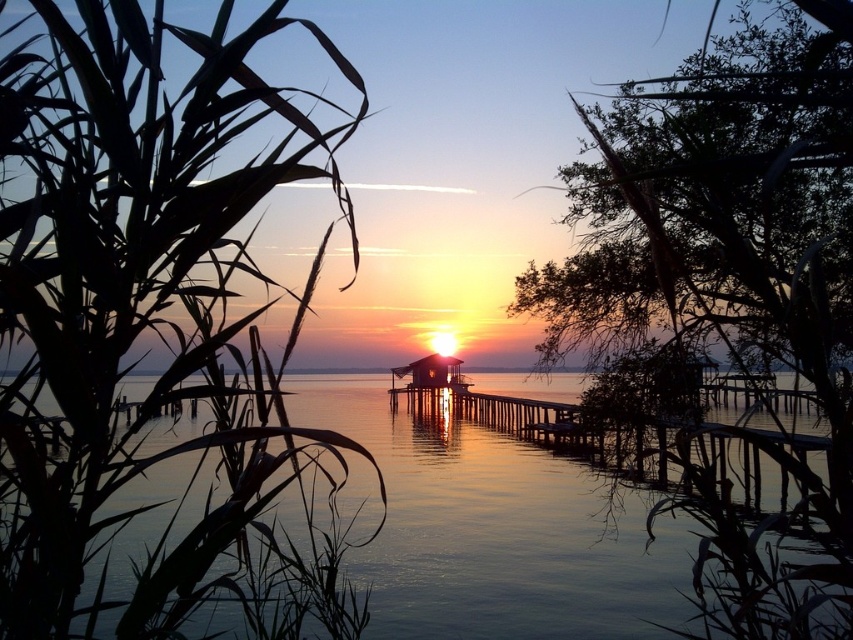
You are an artist sketching the sunset scene. You want to draw the silky green leaves at left and the green leafy tree at upper right. Which object should you draw first to maintain the correct spatial relationship between them?

You should draw the silky green leaves at left first because it is positioned on the left side of the green leafy tree at upper right, so placing it first ensures proper placement relative to the tree.

You are standing at the edge of the water and want to take a photo of the sunset. Which object, the green leafy tree at upper right or the transparent water at center, is located to the right of the other?

The green leafy tree at upper right is positioned on the right side of transparent water at center.

In the scene shown: You are an artist sketching this sunset scene. You want to ensure the silky green leaves at left and the green leafy tree at upper right are proportionally accurate. Which object should you draw larger in your sketch?

The silky green leaves at left should be drawn larger in the sketch because they are larger in size compared to the green leafy tree at upper right according to the description.